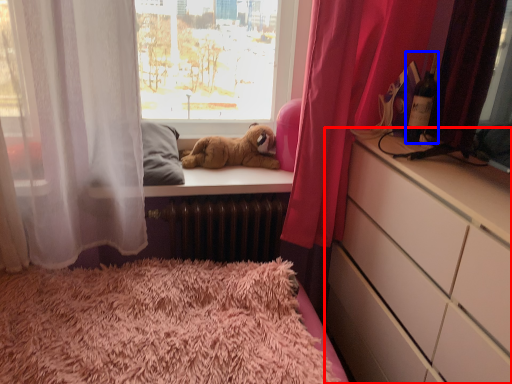
Question: Which object appears farthest to the camera in this image, chest of drawers (highlighted by a red box) or bottle (highlighted by a blue box)?

Choices:
 (A) chest of drawers
 (B) bottle

Answer: (B)